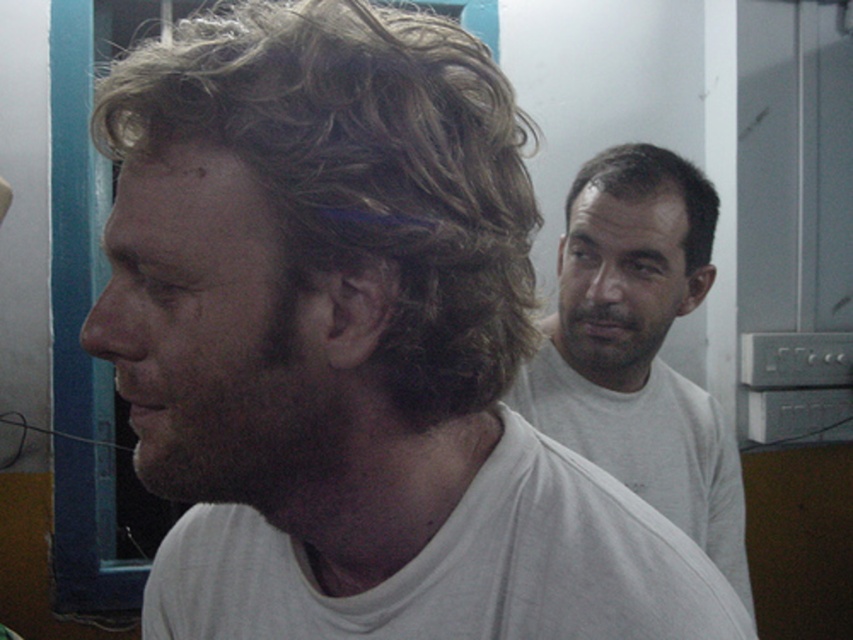
You are standing in the room and want to take a photo of the dark brown fuzzy beard at left without getting too close. If your camera can focus on objects up to 18 inches away, will it be able to capture the beard clearly?

The dark brown fuzzy beard at left and viewer are 17.46 inches apart from each other. Since 17.46 inches is within the camera focus range of up to 18 inches, the camera can capture the dark brown fuzzy beard at left clearly.

You are an artist trying to draw the scene. You need to decide which of the two dark brown features, the dark brown fuzzy beard at left or the dark brown hair at upper right, requires more space on your paper. Which one should you allocate more space to?

The dark brown hair at upper right requires more space because it is larger than the dark brown fuzzy beard at left.